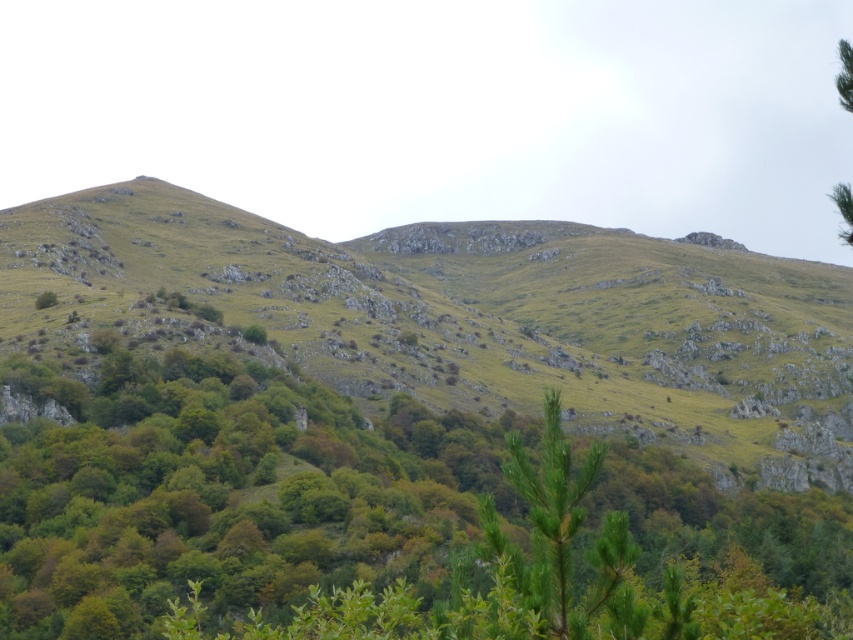
Question: Is green grassy hill at center bigger than green leafy tree at upper right?

Choices:
 (A) no
 (B) yes

Answer: (A)

Question: Which of the following is the closest to the observer?

Choices:
 (A) green grassy hill at center
 (B) green needle-like at center
 (C) green leafy tree at upper right
 (D) green leafy tree at center

Answer: (B)

Question: Among these objects, which one is nearest to the camera?

Choices:
 (A) green grassy hill at center
 (B) green leafy tree at upper right

Answer: (B)

Question: Is green grassy hill at center to the left of green leafy tree at upper right from the viewer's perspective?

Choices:
 (A) no
 (B) yes

Answer: (B)

Question: Which object appears closest to the camera in this image?

Choices:
 (A) green leafy tree at center
 (B) green needle-like at center
 (C) green leafy tree at upper right
 (D) green grassy hill at center

Answer: (B)

Question: Is green grassy hill at center closer to the viewer compared to green leafy tree at upper right?

Choices:
 (A) yes
 (B) no

Answer: (B)